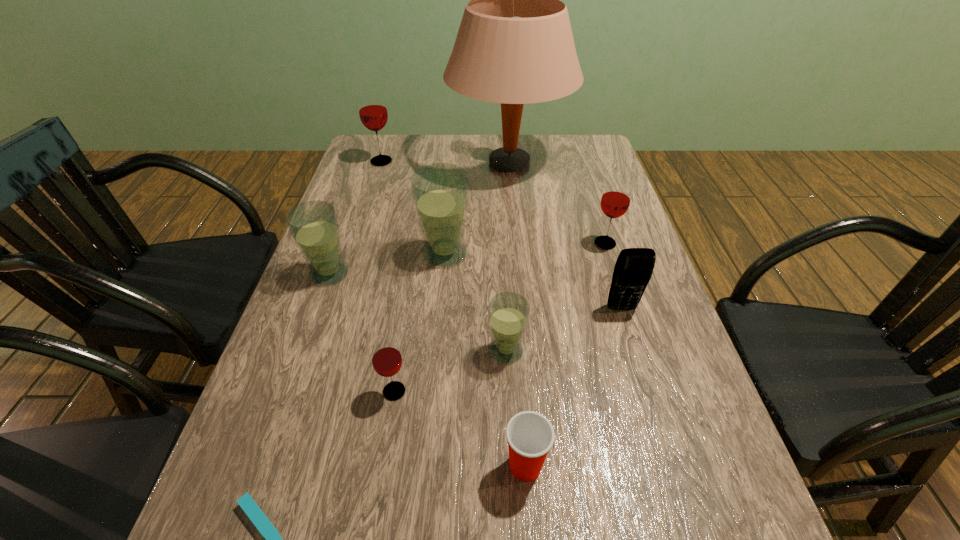
Identify the location of lampshade. (514, 46).

The width and height of the screenshot is (960, 540). Identify the location of brown lampshade. (514, 46).

Locate an element on the screen. The width and height of the screenshot is (960, 540). the farthest glass is located at coordinates (373, 113).

I want to click on the leftmost red glass, so click(373, 113).

The image size is (960, 540). I want to click on the second blue glass from right to left, so click(440, 191).

Where is `the second smallest red glass`? The height and width of the screenshot is (540, 960). the second smallest red glass is located at coordinates (615, 201).

This screenshot has width=960, height=540. What are the coordinates of `the second farthest red glass` in the screenshot? It's located at (615, 201).

Where is `the second smallest blue glass`? The image size is (960, 540). the second smallest blue glass is located at coordinates (314, 225).

At what (x,y) coordinates should I click in order to perform the action: click on cellular telephone. Please return your answer as a coordinate pair (x, y). Looking at the image, I should click on (634, 266).

At what (x,y) coordinates should I click in order to perform the action: click on the second red glass from right to left. Please return your answer as a coordinate pair (x, y). The width and height of the screenshot is (960, 540). Looking at the image, I should click on (386, 358).